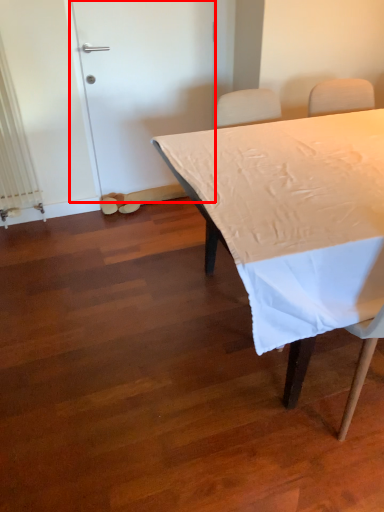
Question: From the image's perspective, considering the relative positions of door (annotated by the red box) and table in the image provided, where is door (annotated by the red box) located with respect to the staircase?

Choices:
 (A) below
 (B) above

Answer: (B)